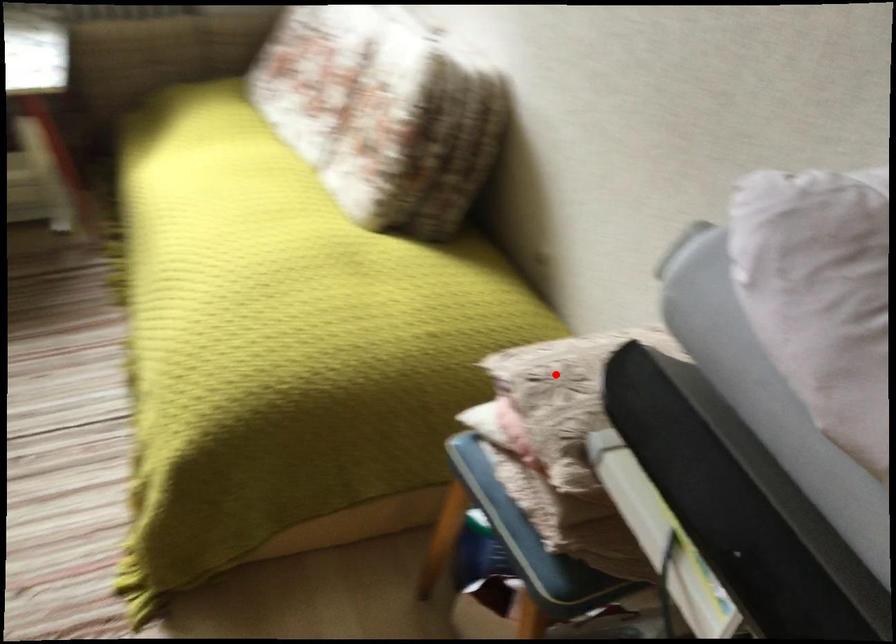
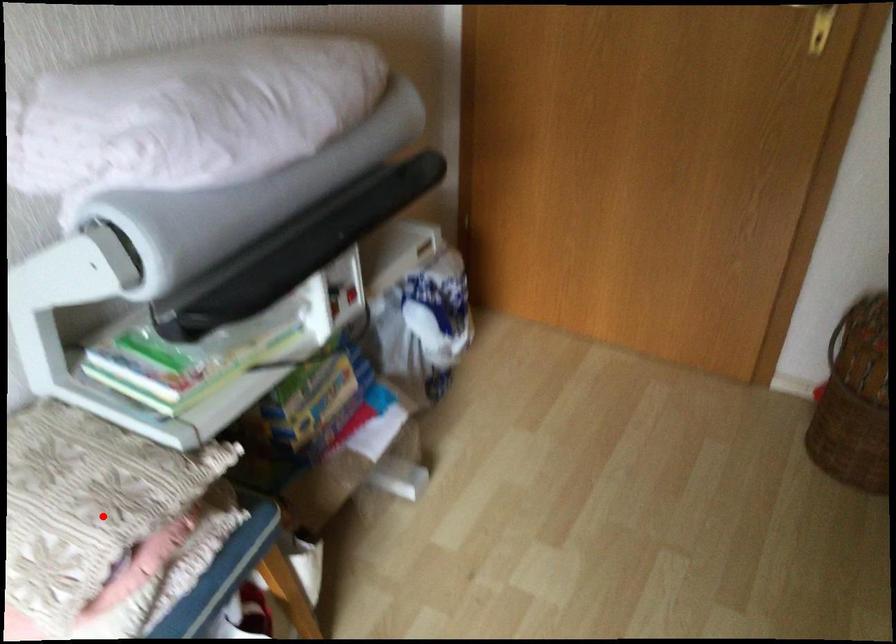
In the scene shown: I am providing you with two images of the same scene from different viewpoints. A red point is marked on the first image and another point is marked on the second image. Is the marked point in image1 the same physical position as the marked point in image2?

Yes